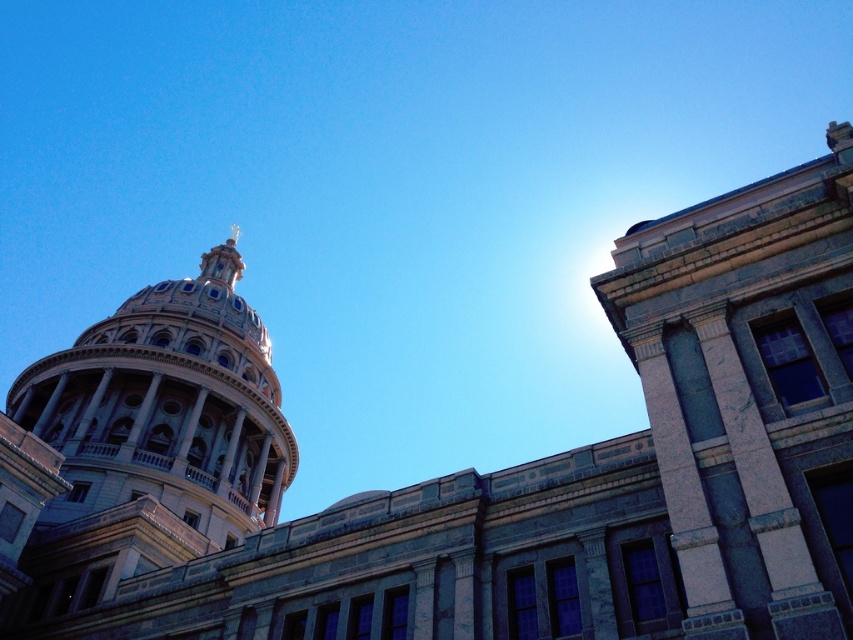
You are standing in the plaza below the grand building. You notice two structures above you. Which one is closer to you, the gray stone building at upper right or the marble dome at upper left?

Result: The gray stone building at upper right is closer to you because it is positioned in front of the marble dome at upper left.

You are standing in front of the grand building and looking up at its dome. You notice two points marked on the dome surface. The first point is at coordinates point [137,413], and the second is at point [227,257]. Which of these points is closer to your eyes?

Point [137,413] is closer to the viewer than point [227,257].

You are an architect analyzing the building from a low angle. You notice the marble dome at upper left and the gold metallic spire at upper center. Which of these two objects appears bigger in the image?

The marble dome at upper left appears bigger than the gold metallic spire at upper center in the image.